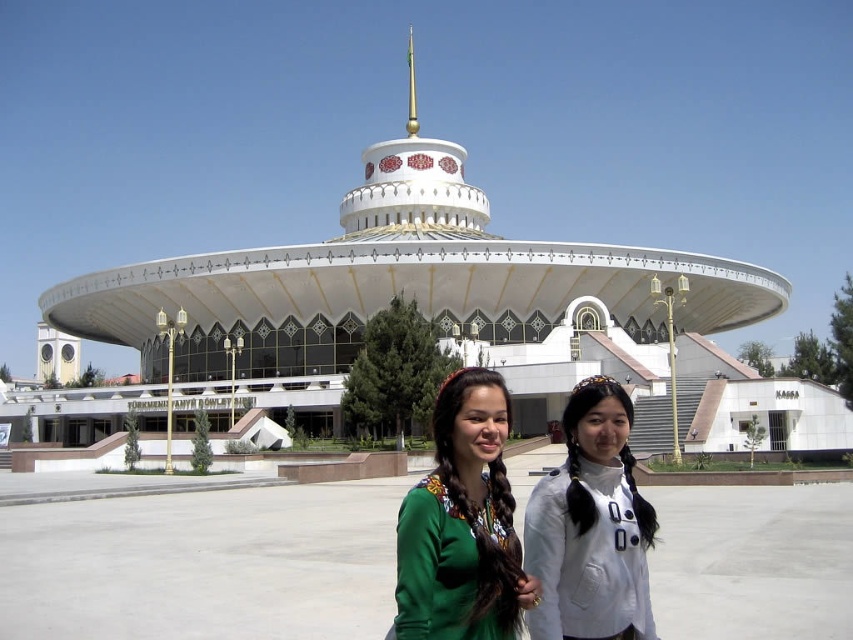
Question: Which point appears farthest from the camera in this image?

Choices:
 (A) (404, 573)
 (B) (544, 529)

Answer: (B)

Question: Is green woven blouse at center to the left of white matte shirt at center from the viewer's perspective?

Choices:
 (A) no
 (B) yes

Answer: (B)

Question: Can you confirm if green woven blouse at center is positioned to the left of white matte shirt at center?

Choices:
 (A) no
 (B) yes

Answer: (B)

Question: Which of the following is the closest to the observer?

Choices:
 (A) (450, 614)
 (B) (585, 614)

Answer: (A)

Question: Can you confirm if green woven blouse at center is positioned below white matte shirt at center?

Choices:
 (A) no
 (B) yes

Answer: (B)